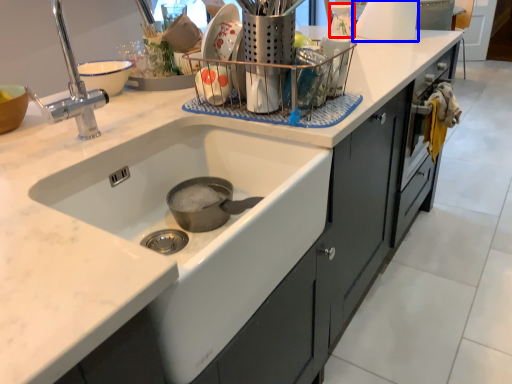
Question: Which object is closer to the camera taking this photo, appliance (highlighted by a red box) or appliance (highlighted by a blue box)?

Choices:
 (A) appliance
 (B) appliance

Answer: (B)